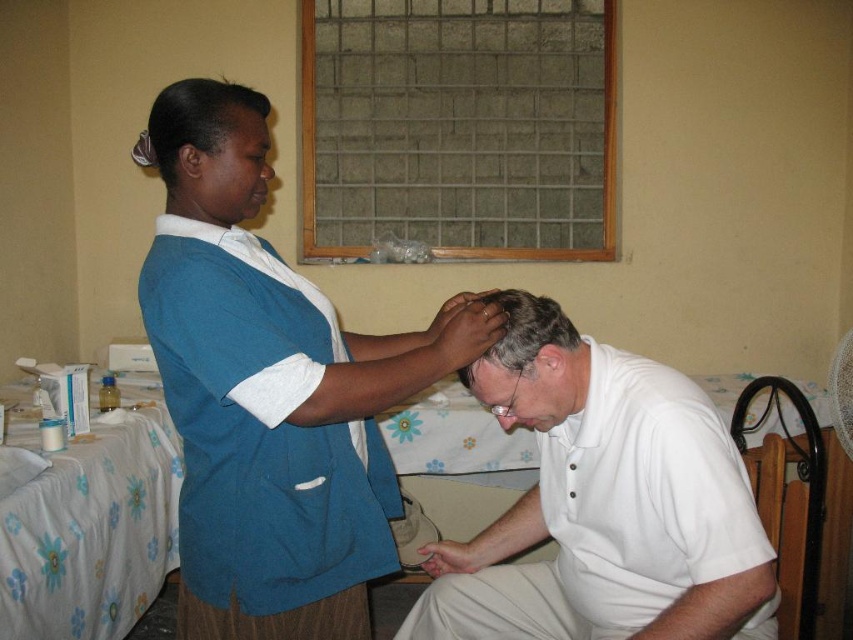
Question: Is teal fabric uniform at center thinner than gray matte hair at center?

Choices:
 (A) no
 (B) yes

Answer: (A)

Question: Among these points, which one is farthest from the camera?

Choices:
 (A) (523, 330)
 (B) (572, 390)
 (C) (479, 371)
 (D) (244, 100)

Answer: (C)

Question: Is matte blue uniform at upper left wider than smooth skin forehead at center?

Choices:
 (A) yes
 (B) no

Answer: (A)

Question: Can you confirm if matte blue uniform at upper left is positioned to the left of smooth skin forehead at center?

Choices:
 (A) no
 (B) yes

Answer: (B)

Question: Which point appears closest to the camera in this image?

Choices:
 (A) (358, 548)
 (B) (563, 348)

Answer: (B)

Question: Among these points, which one is farthest from the camera?

Choices:
 (A) (477, 396)
 (B) (733, 540)
 (C) (218, 220)

Answer: (A)